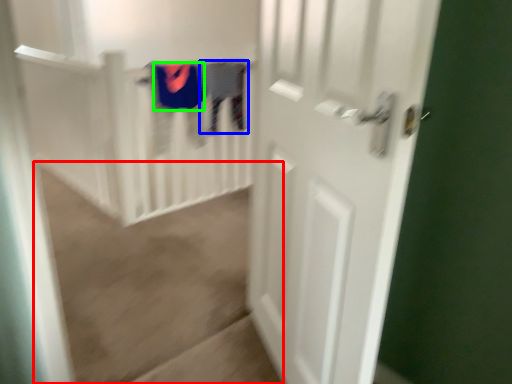
Question: Considering the real-world distances, which object is closest to plain (highlighted by a red box)? clothing (highlighted by a blue box) or clothing (highlighted by a green box).

Choices:
 (A) clothing
 (B) clothing

Answer: (B)